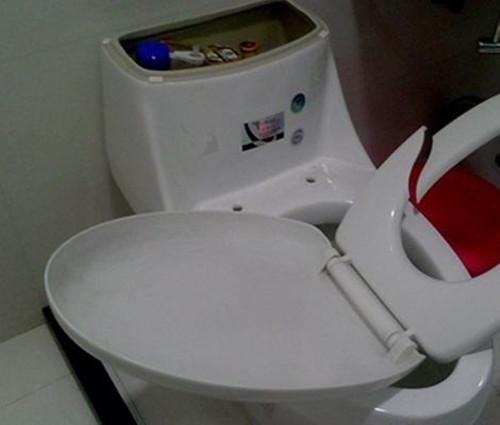
The width and height of the screenshot is (500, 425). I want to click on open top to toilet, so click(273, 32).